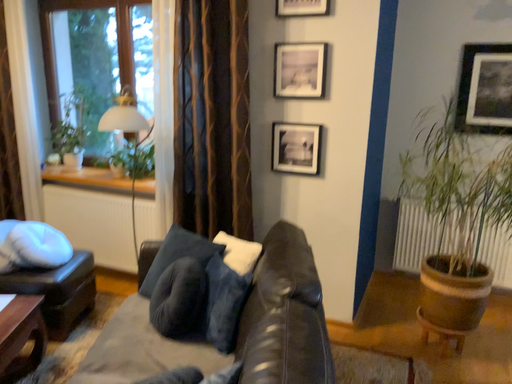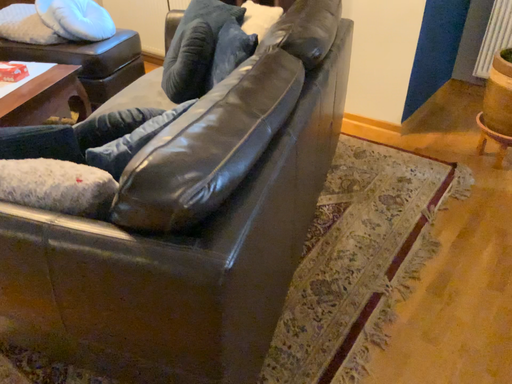
Question: Which way did the camera rotate in the video?

Choices:
 (A) rotated left
 (B) rotated right

Answer: (A)